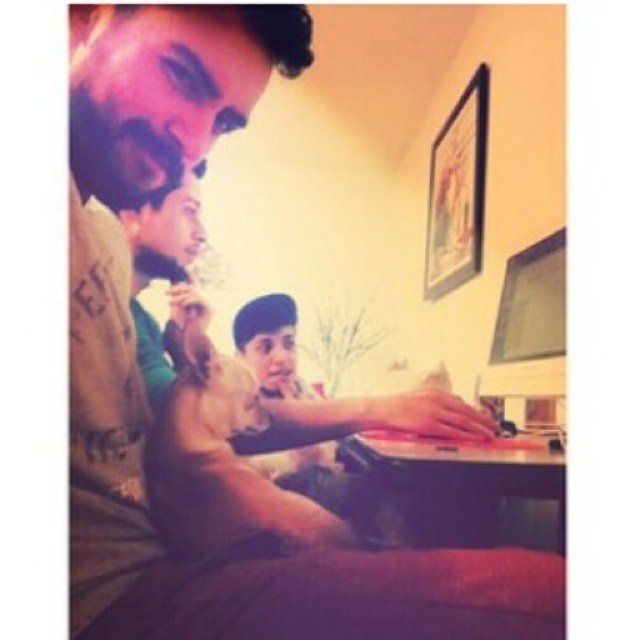
Question: Which point is closer to the camera?

Choices:
 (A) (512, 275)
 (B) (125, 56)

Answer: (B)

Question: Which point is closer to the camera?

Choices:
 (A) pos(93,275)
 (B) pos(516,256)
 (C) pos(184,244)

Answer: (A)

Question: Can you confirm if matte brown shirt at left is positioned to the left of matte plastic monitor at upper right?

Choices:
 (A) no
 (B) yes

Answer: (B)

Question: Which point is farther to the camera?

Choices:
 (A) (502, 282)
 (B) (138, 248)
 (C) (122, 365)

Answer: (A)

Question: Can you confirm if matte brown shirt at left is bigger than matte brown hair at upper left?

Choices:
 (A) no
 (B) yes

Answer: (B)

Question: In this image, where is matte brown shirt at left located relative to matte brown hair at upper left?

Choices:
 (A) right
 (B) left

Answer: (B)